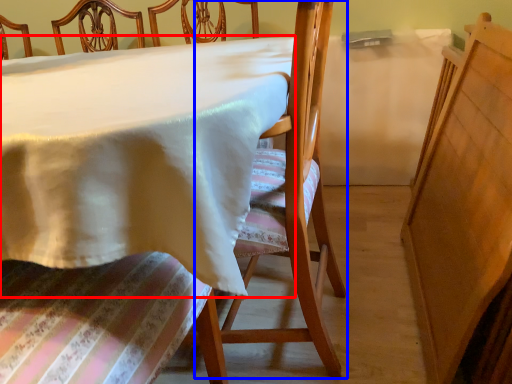
Question: Which object appears closest to the camera in this image, table (highlighted by a red box) or chair (highlighted by a blue box)?

Choices:
 (A) table
 (B) chair

Answer: (A)